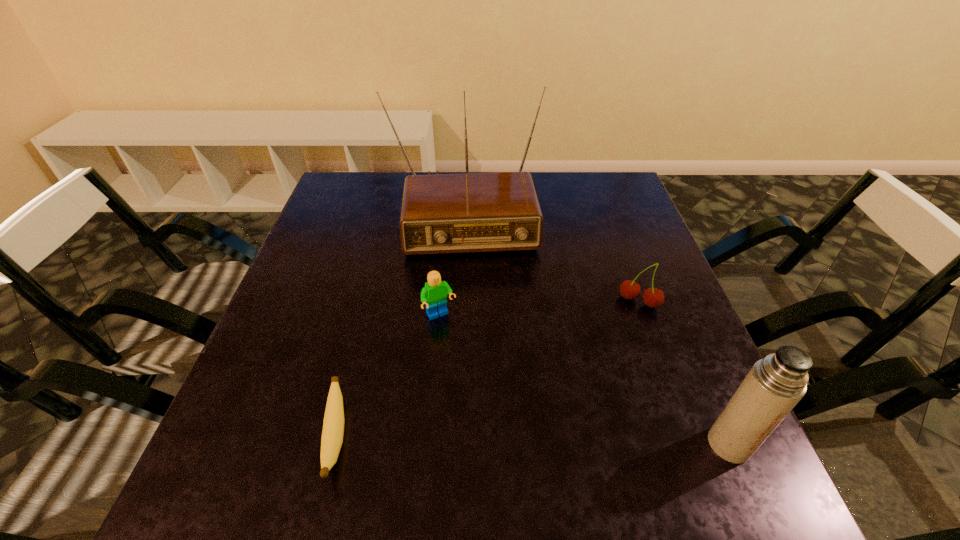
You are a GUI agent. You are given a task and a screenshot of the screen. Output one action in this format:
    pyautogui.click(x=<x>, y=<y>)
    Task: Click on the thermos bottle situated at the right edge
    
    Given the screenshot: What is the action you would take?
    pyautogui.click(x=775, y=384)

Identify the location of cherry at the right edge. The width and height of the screenshot is (960, 540). (653, 297).

Where is `object that is positioned at the near right corner`? object that is positioned at the near right corner is located at coordinates (x=775, y=384).

In the image, there is a desktop. What are the coordinates of `blank space at the far edge` in the screenshot? It's located at (566, 185).

In the image, there is a desktop. Where is `free space at the near edge`? This screenshot has height=540, width=960. free space at the near edge is located at coordinates (460, 449).

This screenshot has width=960, height=540. In the image, there is a desktop. What are the coordinates of `vacant area at the left edge` in the screenshot? It's located at (x=279, y=381).

This screenshot has width=960, height=540. Find the location of `free location at the right edge`. free location at the right edge is located at coordinates (603, 288).

Image resolution: width=960 pixels, height=540 pixels. Identify the location of blank area at the far left corner. (349, 178).

The height and width of the screenshot is (540, 960). Find the location of `vacant space at the far right corner`. vacant space at the far right corner is located at coordinates (577, 181).

Locate an element on the screen. The image size is (960, 540). free spot between the thermos bottle and the Lego is located at coordinates (585, 380).